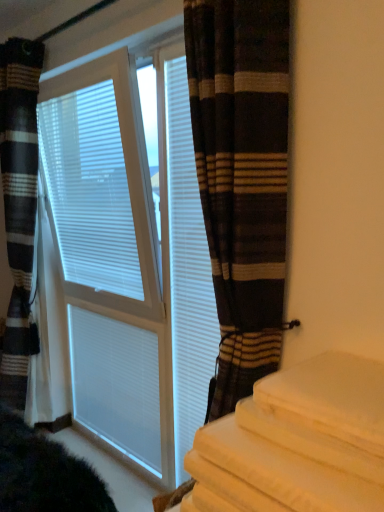
Question: Does white textured blinds at center have a larger size compared to white matte shutter at center, acting as the second shutter starting from the right?

Choices:
 (A) yes
 (B) no

Answer: (A)

Question: Is white textured blinds at center further to the viewer compared to white matte shutter at center, acting as the second shutter starting from the right?

Choices:
 (A) yes
 (B) no

Answer: (B)

Question: Is white textured blinds at center outside white matte shutter at center, which is the first shutter in back-to-front order?

Choices:
 (A) yes
 (B) no

Answer: (A)

Question: Can you confirm if white textured blinds at center is taller than white matte shutter at center, which appears as the second shutter when viewed from the front?

Choices:
 (A) yes
 (B) no

Answer: (A)

Question: From the image's perspective, is white textured blinds at center above white matte shutter at center, which is the first shutter from left to right?

Choices:
 (A) no
 (B) yes

Answer: (B)

Question: From a real-world perspective, is white matte shutter at center, which ranks as the second shutter in back-to-front order, positioned above or below brown striped curtain at center, the first curtain in the front-to-back sequence?

Choices:
 (A) above
 (B) below

Answer: (B)

Question: Choose the correct answer: Is white matte shutter at center, which ranks as the second shutter in back-to-front order, inside brown striped curtain at center, the first curtain in the front-to-back sequence, or outside it?

Choices:
 (A) outside
 (B) inside

Answer: (A)

Question: Based on their sizes in the image, would you say white matte shutter at center, which appears as the 2th shutter when viewed from the left, is bigger or smaller than brown striped curtain at center, which is counted as the second curtain, starting from the back?

Choices:
 (A) big
 (B) small

Answer: (B)

Question: From the image's perspective, is white matte shutter at center, the 1th shutter in the front-to-back sequence, positioned above or below brown striped curtain at center, which is counted as the second curtain, starting from the back?

Choices:
 (A) above
 (B) below

Answer: (B)

Question: From a real-world perspective, relative to striped fabric curtain at left, the 2th curtain in the right-to-left sequence, is white matte shutter at center, which appears as the 2th shutter when viewed from the left, vertically above or below?

Choices:
 (A) below
 (B) above

Answer: (B)

Question: Is white matte shutter at center, placed as the first shutter when sorted from right to left, wider or thinner than striped fabric curtain at left, the first curtain viewed from the back?

Choices:
 (A) thin
 (B) wide

Answer: (A)

Question: Visually, is white matte shutter at center, which appears as the 2th shutter when viewed from the left, positioned to the left or to the right of striped fabric curtain at left, which appears as the 2th curtain when viewed from the front?

Choices:
 (A) right
 (B) left

Answer: (A)

Question: In terms of height, does white matte shutter at center, which ranks as the second shutter in back-to-front order, look taller or shorter compared to striped fabric curtain at left, the 2th curtain in the right-to-left sequence?

Choices:
 (A) short
 (B) tall

Answer: (A)

Question: Would you say striped fabric curtain at left, the 2th curtain in the right-to-left sequence, is inside or outside white textured blinds at center?

Choices:
 (A) outside
 (B) inside

Answer: (A)

Question: In terms of size, does striped fabric curtain at left, the first curtain viewed from the back, appear bigger or smaller than white textured blinds at center?

Choices:
 (A) small
 (B) big

Answer: (A)